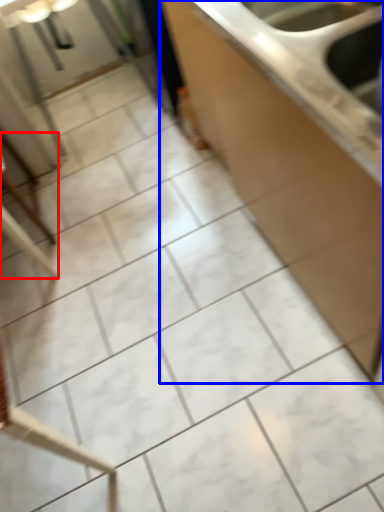
Question: Which of the following is the closest to the observer, furniture (highlighted by a red box) or countertop (highlighted by a blue box)?

Choices:
 (A) furniture
 (B) countertop

Answer: (B)